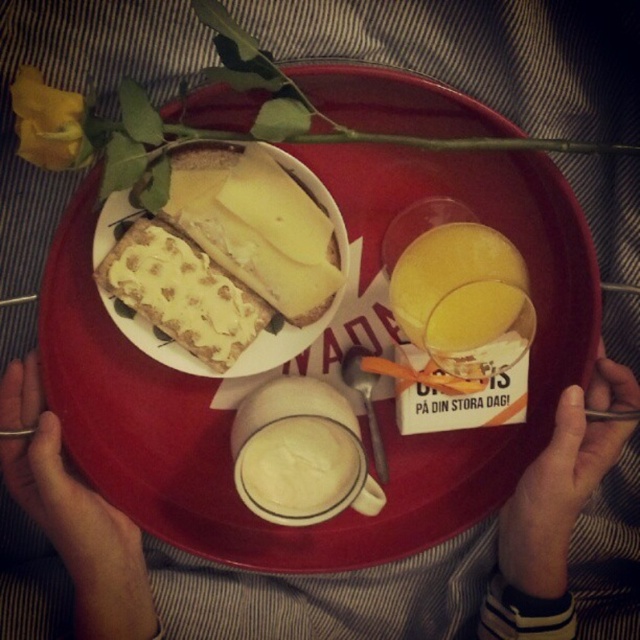
You are a barista preparing a coffee order. You need to place the white ceramic mug at center on the tray. The customer has specified that the mug must be placed exactly 25.79 inches away from the orange juice carton. Can you confirm if the current placement meets the customer requirement?

Yes, the white ceramic mug at center is exactly 25.79 inches away from the orange juice carton, so the current placement meets the customer requirement.

You are a guest at a breakfast table and want to pour the orange juice from the carton into the white ceramic mug at center without spilling any cheese from the white crumbly cheese at upper left. Is this possible given their positions?

The white ceramic mug at center is positioned under the white crumbly cheese at upper left, so pouring the juice might cause the cheese to spill. You should move the cheese first to avoid spillage.